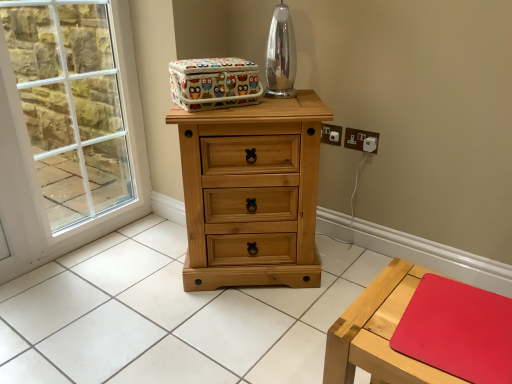
The height and width of the screenshot is (384, 512). What are the coordinates of `empty space that is ontop of wooden table at lower right (from a real-world perspective)` in the screenshot? It's located at (436, 318).